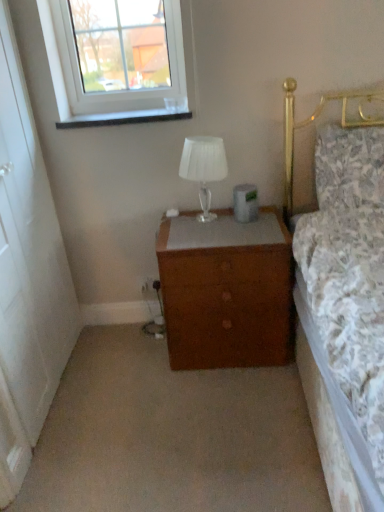
Question: From the image's perspective, is brown wooden chest of drawers at center beneath floral fabric pillow at upper right?

Choices:
 (A) no
 (B) yes

Answer: (B)

Question: Could floral fabric pillow at upper right be considered to be inside brown wooden chest of drawers at center?

Choices:
 (A) yes
 (B) no

Answer: (B)

Question: From a real-world perspective, is brown wooden chest of drawers at center on top of floral fabric pillow at upper right?

Choices:
 (A) yes
 (B) no

Answer: (B)

Question: Is brown wooden chest of drawers at center wider than floral fabric pillow at upper right?

Choices:
 (A) yes
 (B) no

Answer: (A)

Question: Is brown wooden chest of drawers at center oriented towards floral fabric pillow at upper right?

Choices:
 (A) yes
 (B) no

Answer: (B)

Question: Considering the relative sizes of brown wooden chest of drawers at center and floral fabric pillow at upper right in the image provided, is brown wooden chest of drawers at center taller than floral fabric pillow at upper right?

Choices:
 (A) yes
 (B) no

Answer: (A)

Question: From a real-world perspective, is translucent glass lamp at center located beneath brown wooden chest of drawers at center?

Choices:
 (A) yes
 (B) no

Answer: (B)

Question: Could you tell me if translucent glass lamp at center is turned towards brown wooden chest of drawers at center?

Choices:
 (A) yes
 (B) no

Answer: (B)

Question: Considering the relative positions of translucent glass lamp at center and brown wooden chest of drawers at center in the image provided, is translucent glass lamp at center to the right of brown wooden chest of drawers at center from the viewer's perspective?

Choices:
 (A) yes
 (B) no

Answer: (B)

Question: Considering the relative sizes of translucent glass lamp at center and brown wooden chest of drawers at center in the image provided, is translucent glass lamp at center taller than brown wooden chest of drawers at center?

Choices:
 (A) no
 (B) yes

Answer: (A)

Question: Is translucent glass lamp at center far away from brown wooden chest of drawers at center?

Choices:
 (A) no
 (B) yes

Answer: (A)

Question: Is translucent glass lamp at center bigger than brown wooden chest of drawers at center?

Choices:
 (A) yes
 (B) no

Answer: (B)

Question: Is the depth of clear glass window at upper left greater than that of translucent glass lamp at center?

Choices:
 (A) no
 (B) yes

Answer: (B)